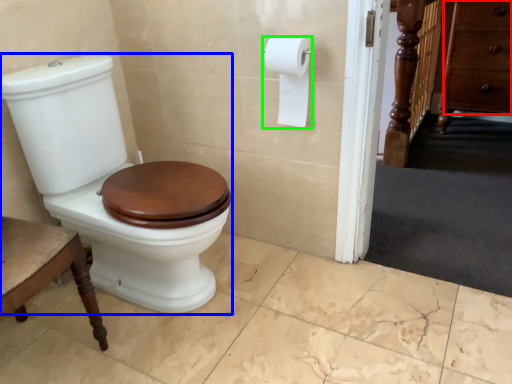
Question: Considering the real-world distances, which object is closest to drawer (highlighted by a red box)? porcelain (highlighted by a blue box) or toilet paper (highlighted by a green box).

Choices:
 (A) porcelain
 (B) toilet paper

Answer: (B)